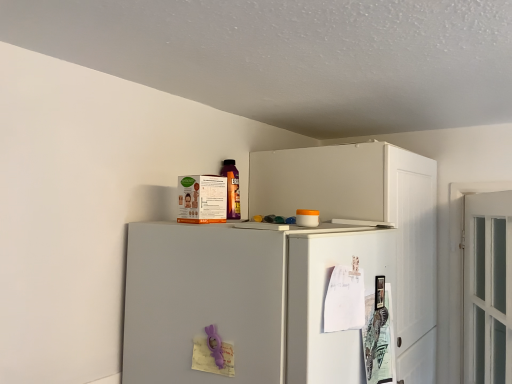
Question: Looking at the image, does white matte cabinet at upper right seem bigger or smaller compared to white paper at upper right, the 2th door viewed from the right?

Choices:
 (A) big
 (B) small

Answer: (A)

Question: From their relative heights in the image, would you say white matte cabinet at upper right is taller or shorter than white paper at upper right, the 2th door viewed from the right?

Choices:
 (A) short
 (B) tall

Answer: (B)

Question: Estimate the real-world distances between objects in this image. Which object is closer to the white glass door at right, the first door viewed from the right?

Choices:
 (A) white matte refrigerator at upper center
 (B) white matte cabinet at upper right
 (C) white paper at upper right, the 2th door viewed from the right

Answer: (B)

Question: Based on their relative distances, which object is nearer to the white glass door at right, which appears as the second door when viewed from the left?

Choices:
 (A) white matte cabinet at upper right
 (B) white matte refrigerator at upper center
 (C) white paper at upper right, the 2th door viewed from the right

Answer: (A)